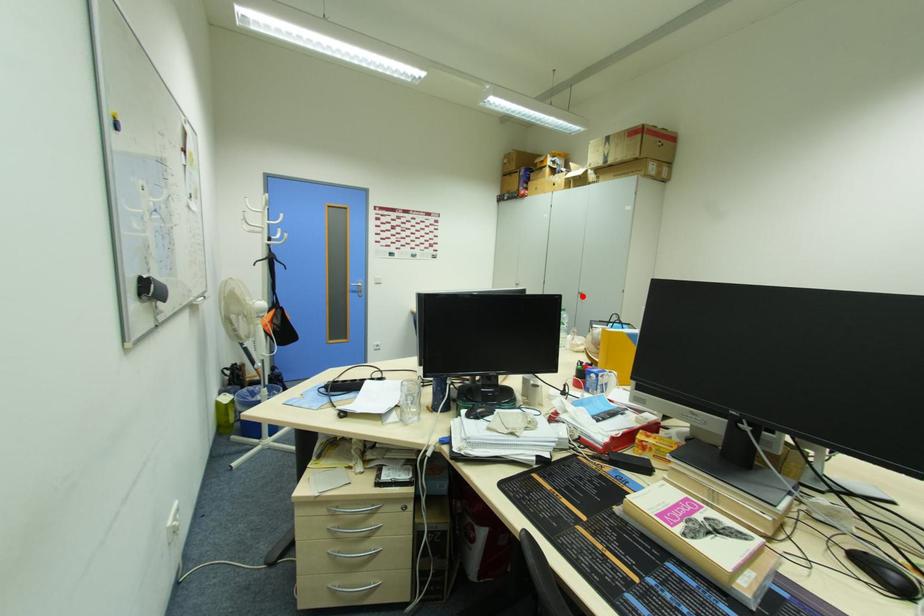
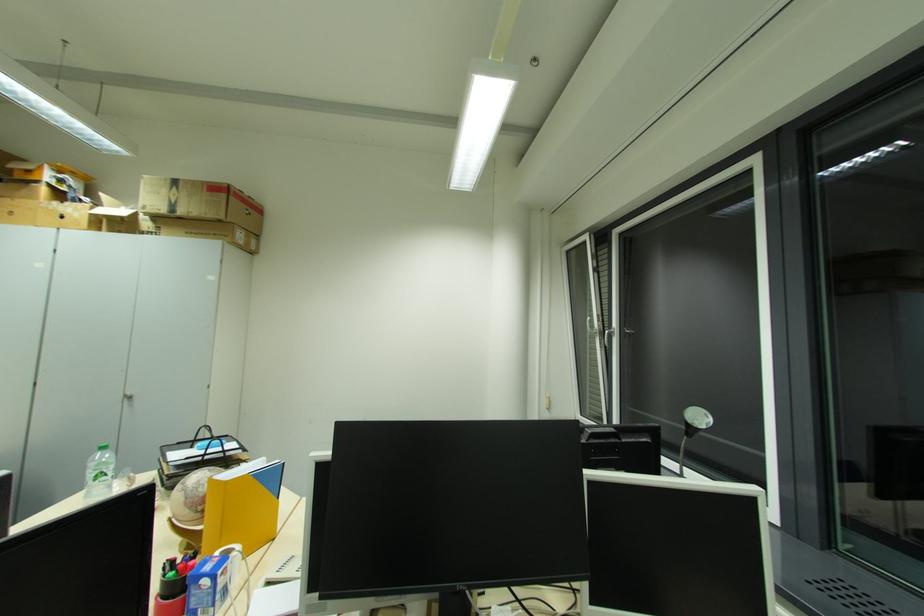
Question: A red point is marked in image1. In image2, is the corresponding 3D point closer to the camera or farther? Reply with the corresponding letter.

Choices:
 (A) The corresponding 3D point is closer.
 (B) The corresponding 3D point is farther.

Answer: (A)